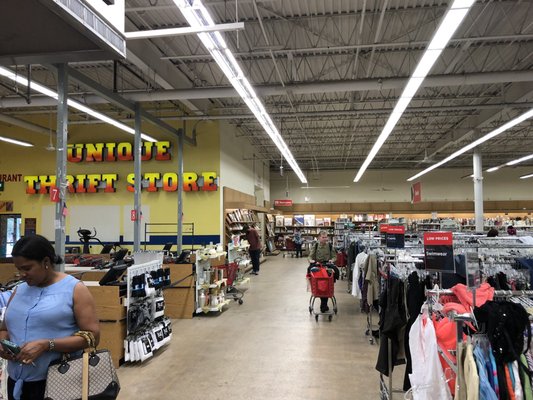
Image resolution: width=533 pixels, height=400 pixels. Identify the location of fluorescent light. (11, 142), (88, 112), (233, 71), (403, 100), (490, 140), (516, 163), (528, 177).